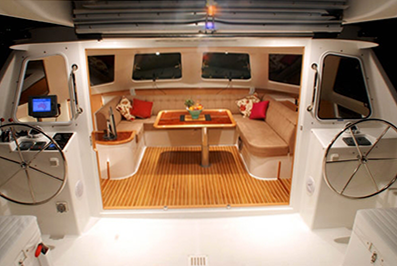
This screenshot has width=397, height=266. In order to click on brown seat cushions in this screenshot , I will do `click(263, 134)`, `click(215, 102)`, `click(126, 126)`.